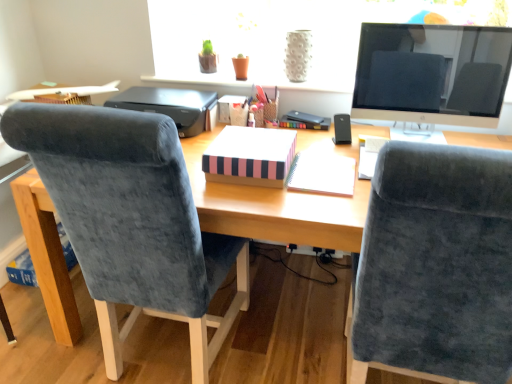
Find the location of a particular element. The width and height of the screenshot is (512, 384). free location in front of white spiral notebook at center, which ranks as the first notebook in right-to-left order is located at coordinates (318, 205).